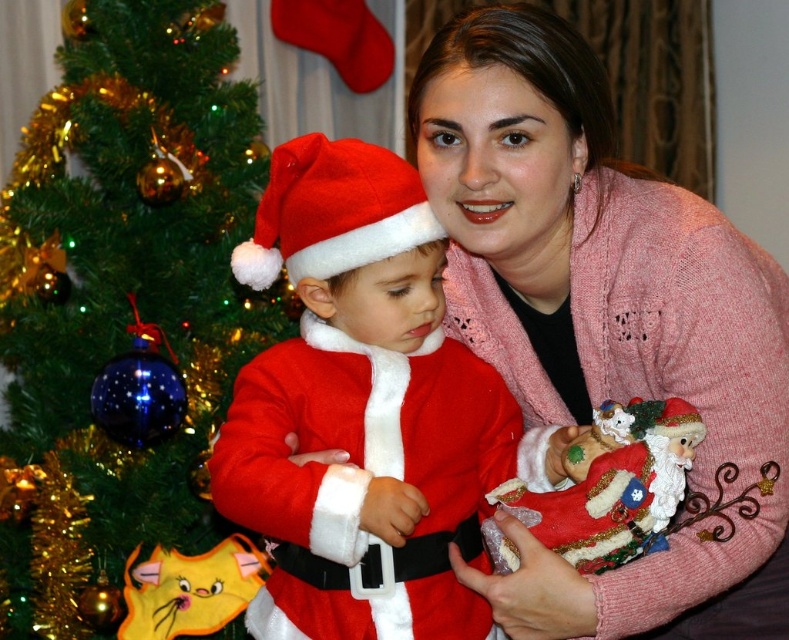
You are a photographer setting up a shot of the festive scene. You want to ensure both the pink knitted sweater at center and the velvet red santa at center are visible in the frame. Which object should you focus on first to capture both in the same shot?

The pink knitted sweater at center is above the velvet red santa at center, so focusing on the pink knitted sweater at center first will allow you to adjust the frame to include both objects.

You are a photographer trying to capture a photo of the fuzzy red santa suit at center and the fuzzy felt santa hat at center. Which object should you focus on first if you want to ensure both are in focus without moving the camera?

The fuzzy red santa suit at center is located below the fuzzy felt santa hat at center, so you should focus on the fuzzy felt santa hat at center first since it is farther away. This way, the depth of field will cover both objects more effectively.